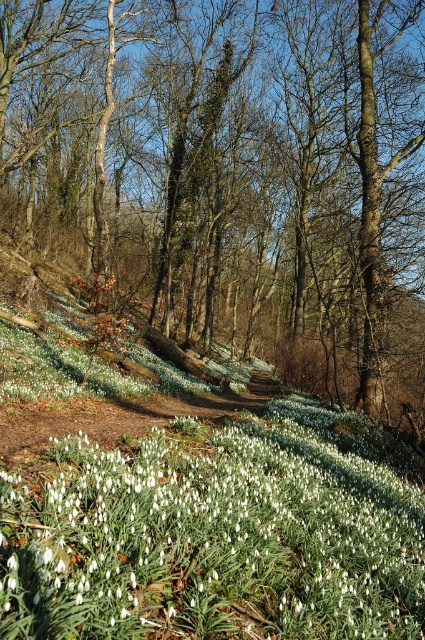
You are a hiker walking along the narrow dirt path in the middle ground of the woodland scene. You notice a brown bark tree at center and a white matte snowdrop at center. Which object is located to the left of the other?

The brown bark tree at center is positioned on the left side of white matte snowdrop at center.

You are a hiker who wants to place a 25 meter long tent between the brown bark tree at center and the white matte snowdrop at center. Is there enough space for the tent?

The brown bark tree at center and the white matte snowdrop at center are 30.06 meters apart, so yes, the tent can be placed between them as the distance is sufficient.

You are a hiker who wants to take a photo of the brown bark tree at center and the white matte snowdrop at center. Which object is wider?

The brown bark tree at center is wider than the white matte snowdrop at center.